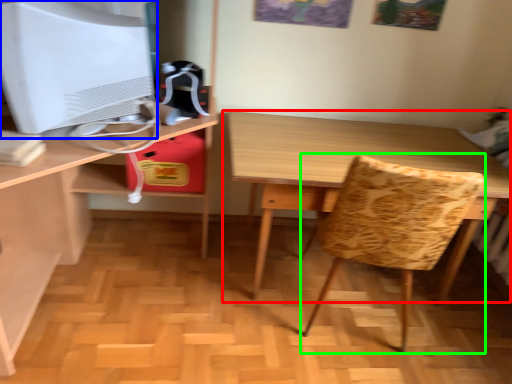
Question: Considering the real-world distances, which object is closest to table (highlighted by a red box)? computer monitor (highlighted by a blue box) or swivel chair (highlighted by a green box).

Choices:
 (A) computer monitor
 (B) swivel chair

Answer: (B)